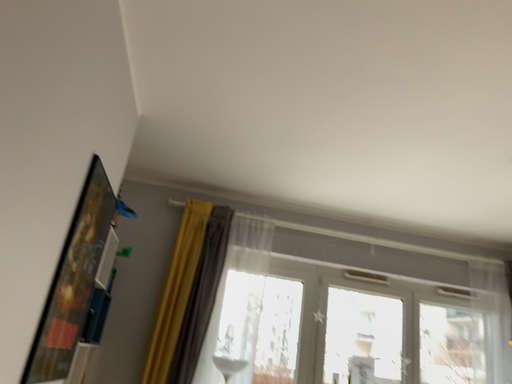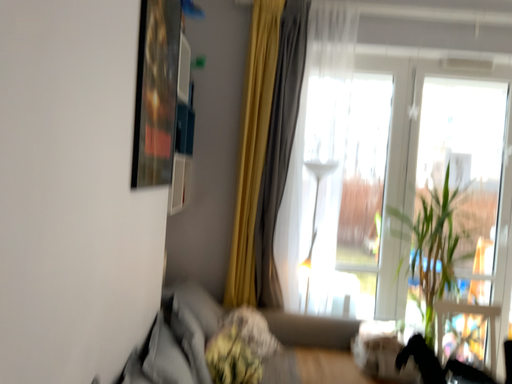
Question: Which way did the camera rotate in the video?

Choices:
 (A) rotated downward
 (B) rotated upward

Answer: (A)